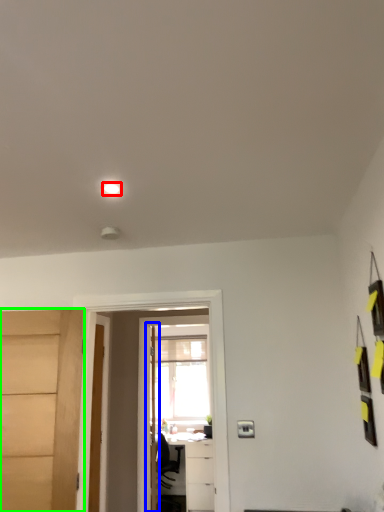
Question: Estimate the real-world distances between objects in this image. Which object is closer to light (highlighted by a red box), door (highlighted by a blue box) or door (highlighted by a green box)?

Choices:
 (A) door
 (B) door

Answer: (B)